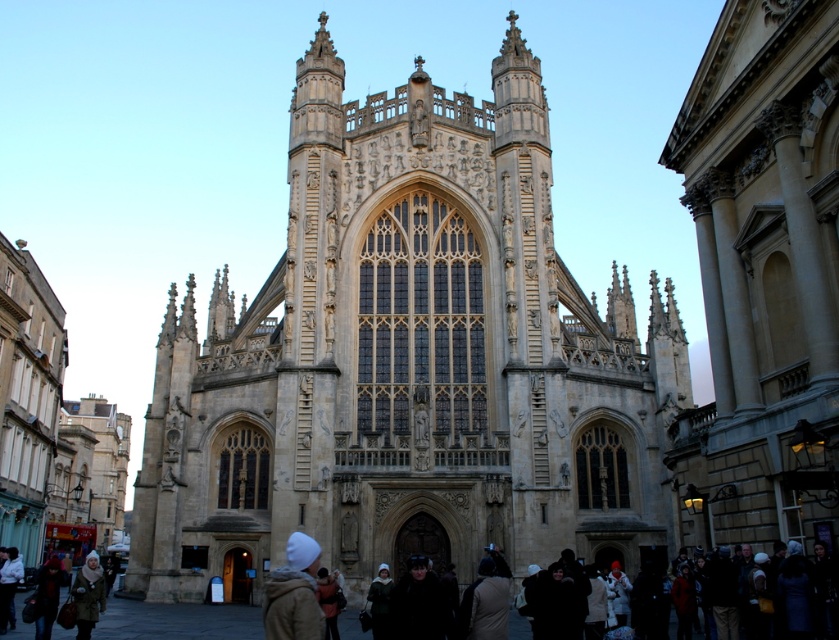
Question: Which of the following is the farthest from the observer?

Choices:
 (A) light brown leather jacket at lower left
 (B) white woolen hat at lower center

Answer: (A)

Question: Which point is closer to the camera?

Choices:
 (A) white woolen hat at lower center
 (B) fluffy white hat at lower left
 (C) beige stone church at center
 (D) light brown leather jacket at lower left

Answer: (A)

Question: Considering the relative positions of fluffy white hat at lower left and light brown leather jacket at lower left in the image provided, where is fluffy white hat at lower left located with respect to light brown leather jacket at lower left?

Choices:
 (A) right
 (B) left

Answer: (B)

Question: Can you confirm if beige stone church at center is positioned above light brown leather jacket at lower left?

Choices:
 (A) no
 (B) yes

Answer: (B)

Question: Is beige stone church at center smaller than light brown leather jacket at lower left?

Choices:
 (A) yes
 (B) no

Answer: (B)

Question: Which object appears farthest from the camera in this image?

Choices:
 (A) white woolen hat at lower center
 (B) beige stone church at center

Answer: (B)